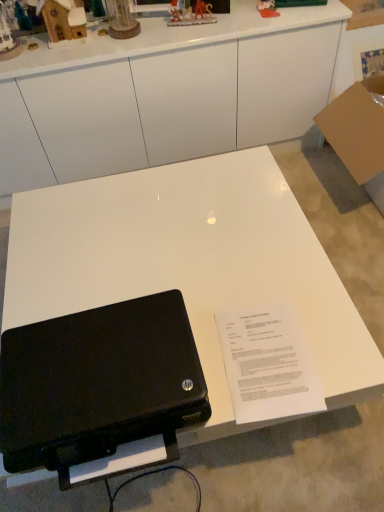
Locate an element on the screen. The height and width of the screenshot is (512, 384). vacant point to the left of plastic toy at upper center, which is the 5th toy in left-to-right order is located at coordinates (225, 17).